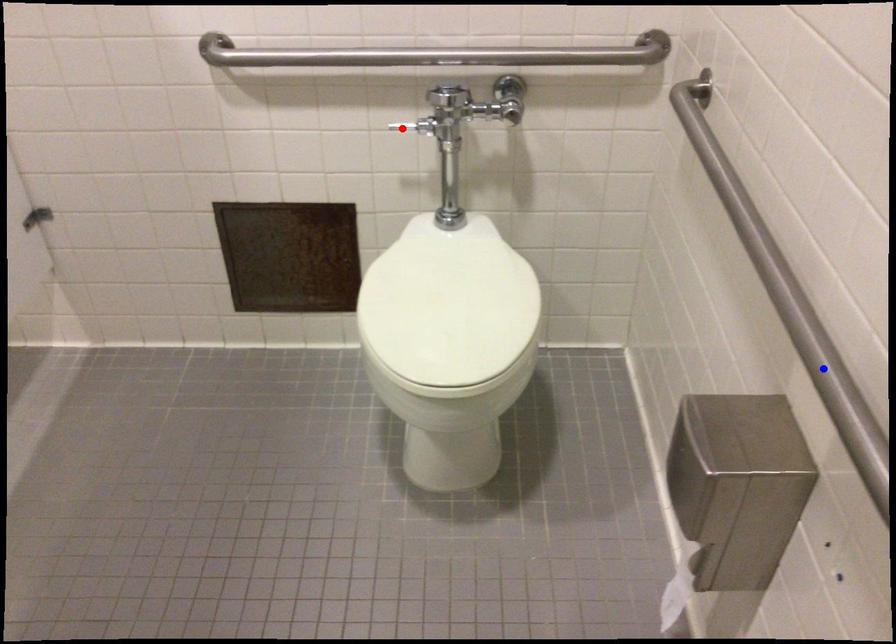
Question: In the image, two points are highlighted. Which point is nearer to the camera? Reply with the corresponding letter.

Choices:
 (A) blue point
 (B) red point

Answer: (A)